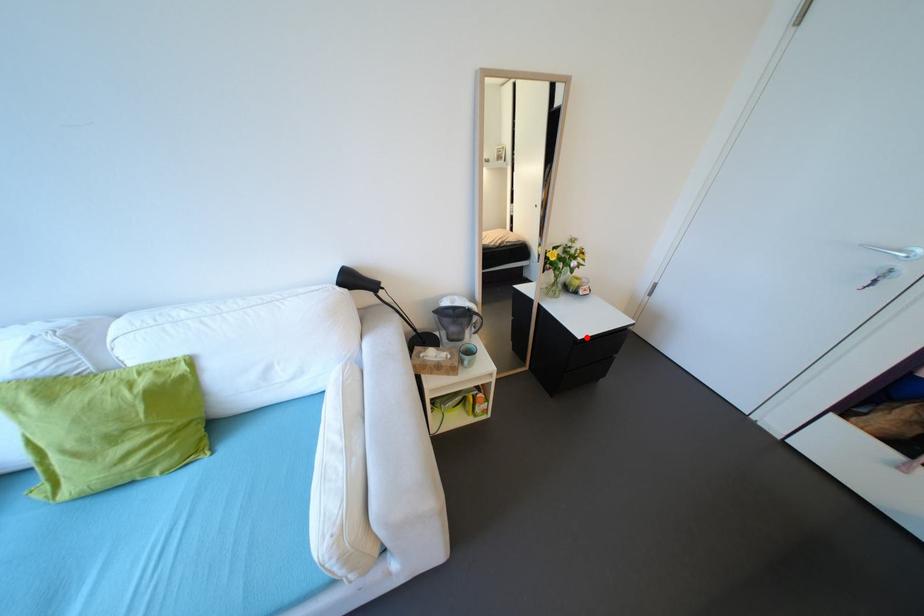
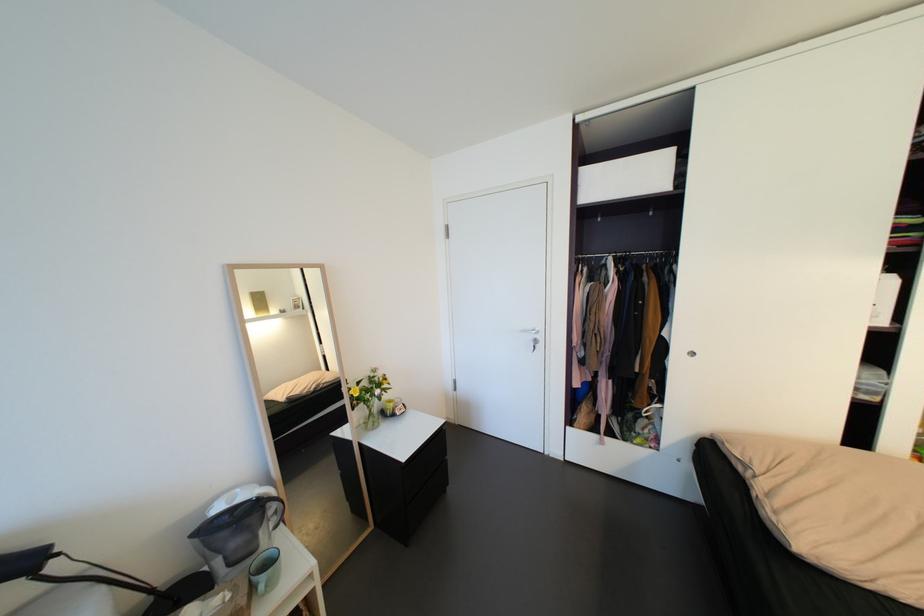
The point at the highlighted location is marked in the first image. Where is the corresponding point in the second image?

(410, 460)